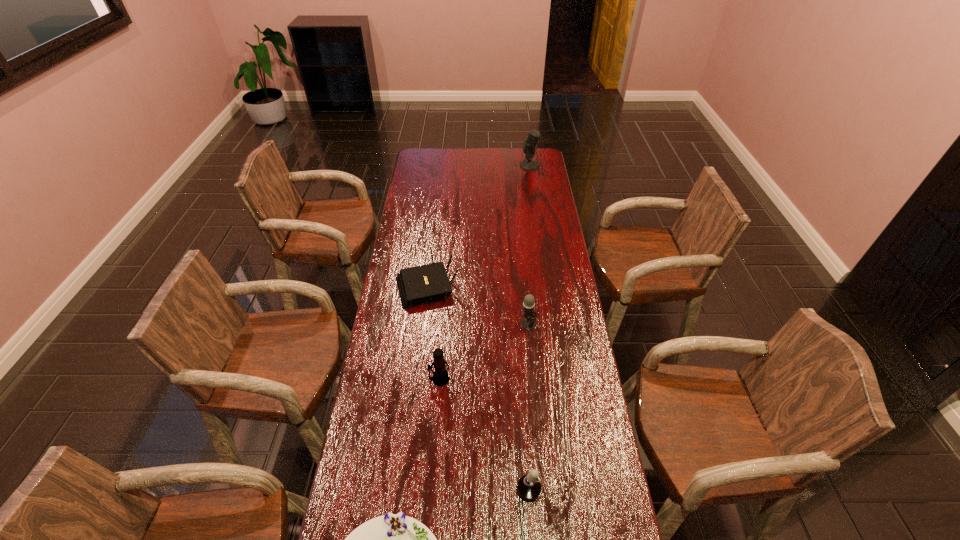
Where is `the farthest microphone`? the farthest microphone is located at coordinates (529, 145).

This screenshot has width=960, height=540. In order to click on the tallest object in this screenshot , I will do `click(529, 145)`.

Identify the location of the fourth farthest object. (440, 377).

Find the location of `the leftmost microphone`. the leftmost microphone is located at coordinates (440, 377).

Locate an element on the screen. The width and height of the screenshot is (960, 540). the third farthest object is located at coordinates (528, 322).

Where is `the nearest microphone`? The height and width of the screenshot is (540, 960). the nearest microphone is located at coordinates (529, 487).

The height and width of the screenshot is (540, 960). I want to click on the shortest microphone, so click(529, 487).

The height and width of the screenshot is (540, 960). Identify the location of router. (419, 285).

Identify the location of vacant space located 0.080m on the back of the tallest microphone. The height and width of the screenshot is (540, 960). (527, 153).

This screenshot has height=540, width=960. I want to click on vacant space positioned on the back of the third nearest object, so click(445, 299).